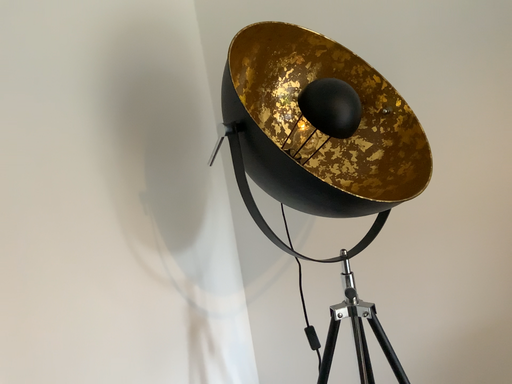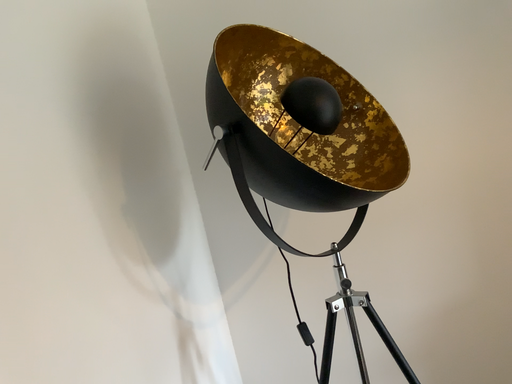
Question: How did the camera likely rotate when shooting the video?

Choices:
 (A) rotated left
 (B) rotated right

Answer: (B)